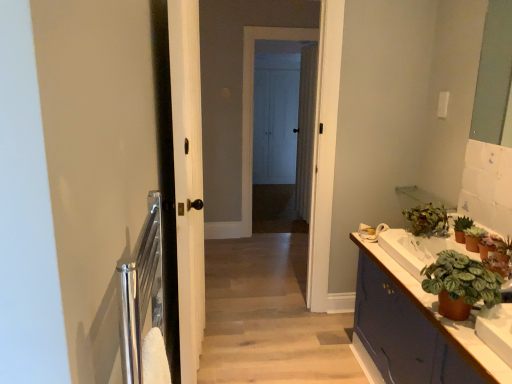
Question: Considering their positions, is green matte plant at right, the 4th houseplant viewed from the back, located in front of or behind matte purple cabinet at right?

Choices:
 (A) front
 (B) behind

Answer: (B)

Question: Considering the positions of green matte plant at right, the 2th houseplant when ordered from front to back, and matte purple cabinet at right in the image, is green matte plant at right, the 2th houseplant when ordered from front to back, bigger or smaller than matte purple cabinet at right?

Choices:
 (A) small
 (B) big

Answer: (A)

Question: Which is farther from the white wood screen door at center, the first screen door from the back?

Choices:
 (A) green matte plant at right, arranged as the 1th houseplant when viewed from the front
 (B) green matte plant at right, the 2th houseplant when ordered from front to back
 (C) white textured curtain at center
 (D) white wood screen door at center, which is counted as the 1th screen door, starting from the front
 (E) white glossy sink at right

Answer: (A)

Question: Which is nearer to the white wood door at center?

Choices:
 (A) matte purple cabinet at right
 (B) green matte plant at right, arranged as the 4th houseplant when viewed from the front
 (C) white textured curtain at center
 (D) green matte plant at right, the 2th houseplant when ordered from front to back
 (E) green matte plant at upper right, the first houseplant positioned from the back

Answer: (A)